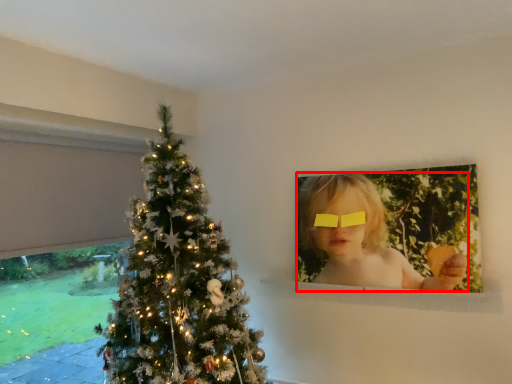
Question: From the image's perspective, what is the correct spatial relationship of girl (annotated by the red box) in relation to glasses?

Choices:
 (A) below
 (B) above

Answer: (A)